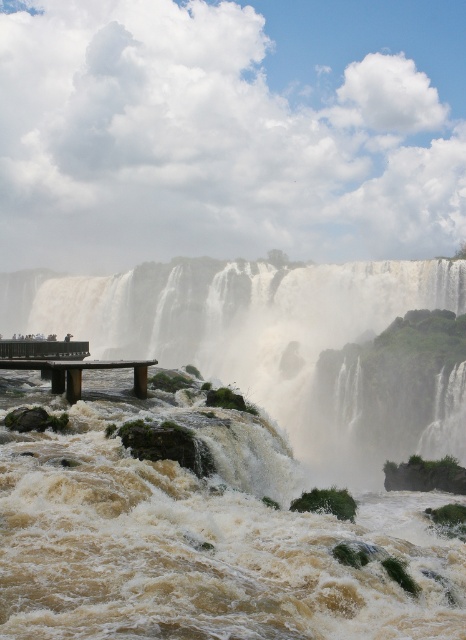
Question: Is brown frothy water at center wider than metallic silver bench at lower left?

Choices:
 (A) no
 (B) yes

Answer: (B)

Question: Which point is closer to the camera?

Choices:
 (A) (453, 429)
 (B) (35, 349)

Answer: (A)

Question: Does brown frothy water at center have a lesser width compared to white frothy water at left?

Choices:
 (A) no
 (B) yes

Answer: (B)

Question: Does metallic silver bench at lower left have a smaller size compared to brown wooden bench at lower left?

Choices:
 (A) no
 (B) yes

Answer: (B)

Question: Estimate the real-world distances between objects in this image. Which object is farther from the brown wooden bench at lower left?

Choices:
 (A) brown frothy water at center
 (B) metallic silver bench at lower left

Answer: (A)

Question: Which point appears closest to the camera in this image?

Choices:
 (A) (57, 360)
 (B) (45, 349)

Answer: (A)